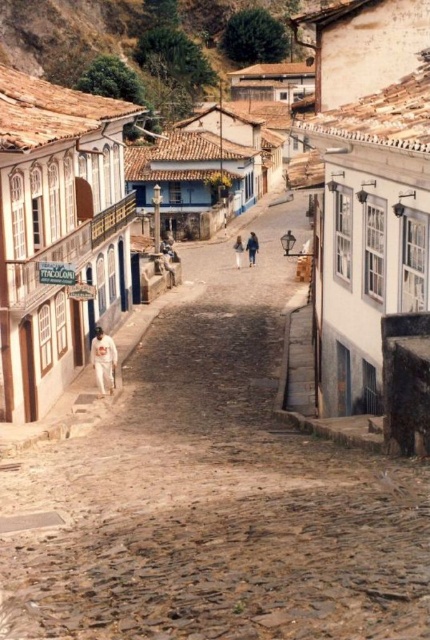
Question: Does white stone street at center appear under blue denim jeans at center?

Choices:
 (A) no
 (B) yes

Answer: (A)

Question: Which of the following is the closest to the observer?

Choices:
 (A) (237, 237)
 (B) (104, 339)

Answer: (B)

Question: Is white cotton pants at lower left below blue denim jeans at center?

Choices:
 (A) yes
 (B) no

Answer: (A)

Question: Is brown cobblestone alley at center behind white cotton pants at lower left?

Choices:
 (A) no
 (B) yes

Answer: (A)

Question: Which object appears closest to the camera in this image?

Choices:
 (A) white cotton pants at lower left
 (B) light blue jeans at center
 (C) white stone street at center

Answer: (C)

Question: Which point is closer to the camera?

Choices:
 (A) brown cobblestone alley at center
 (B) white cotton pants at lower left
 (C) blue denim jeans at center
 (D) white stone street at center

Answer: (A)